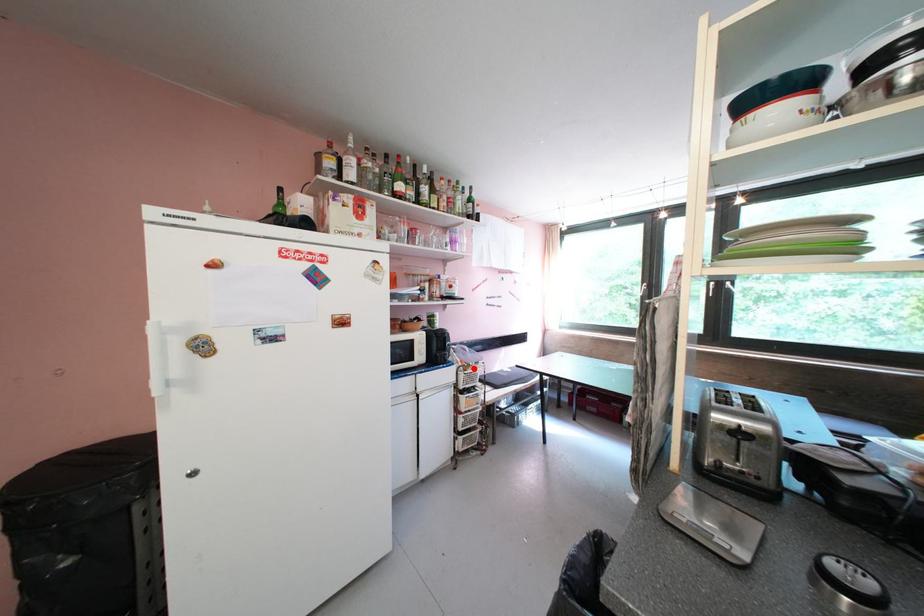
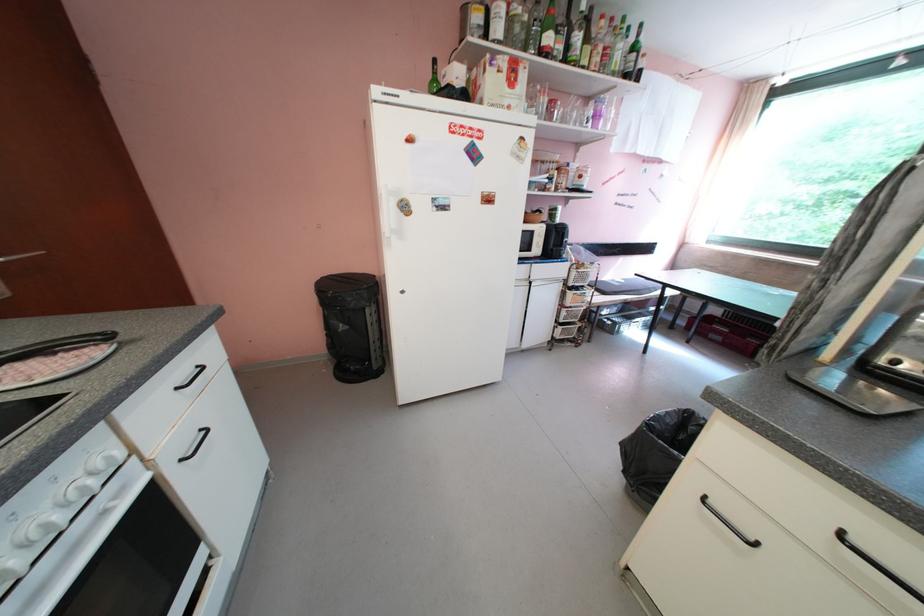
Question: I am providing you with two images of the same scene from different viewpoints. In image1, a red point is highlighted. Considering the same 3D point in image2, which of the following is correct?

Choices:
 (A) It is closer
 (B) It is farther

Answer: (A)